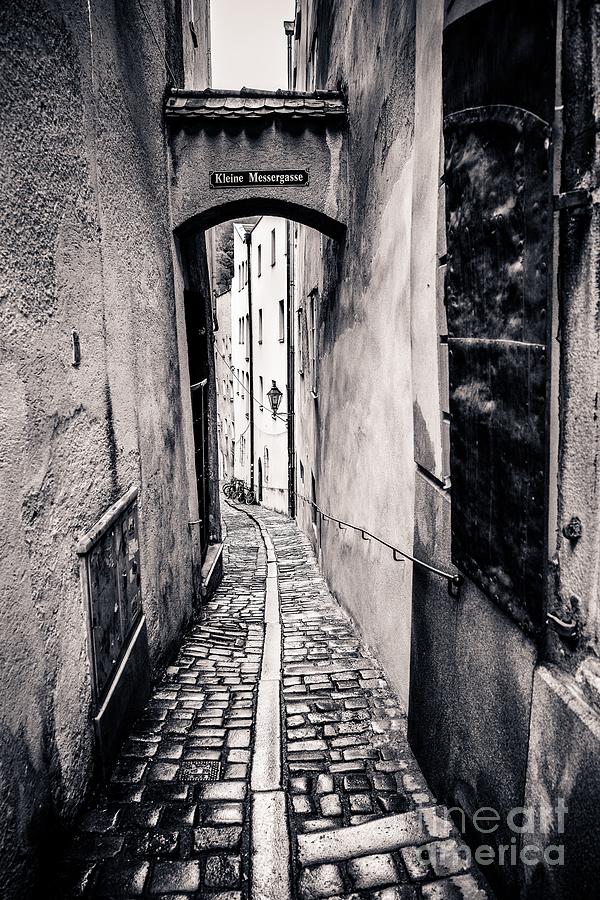
Identify the location of black and white photograph. The height and width of the screenshot is (900, 600). tap(342, 474).